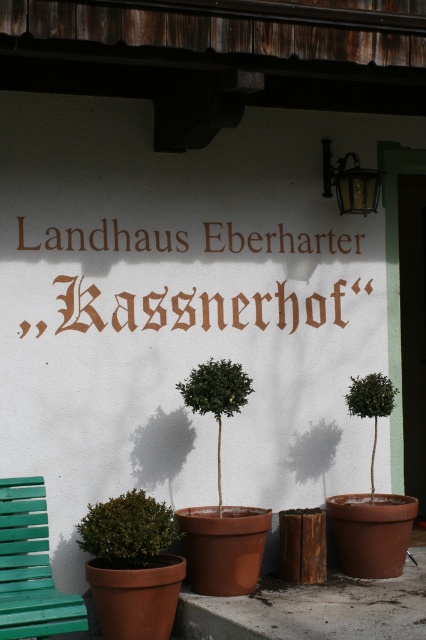
Question: Estimate the real-world distances between objects in this image. Which object is closer to the green matte tree at right?

Choices:
 (A) green painted wood bench at lower left
 (B) green matte plant at lower left
 (C) green matte tree at center

Answer: (C)

Question: Which point is farther to the camera?

Choices:
 (A) (236, 371)
 (B) (354, 410)

Answer: (B)

Question: Does green matte plant at lower left appear on the left side of green matte tree at center?

Choices:
 (A) yes
 (B) no

Answer: (A)

Question: In this image, where is green painted wood bench at lower left located relative to green matte tree at center?

Choices:
 (A) above
 (B) below

Answer: (B)

Question: Does green matte plant at lower left appear on the right side of green matte tree at center?

Choices:
 (A) yes
 (B) no

Answer: (B)

Question: Which of the following is the closest to the observer?

Choices:
 (A) green matte tree at right
 (B) green painted wood bench at lower left
 (C) green matte tree at center
 (D) green matte plant at lower left

Answer: (B)